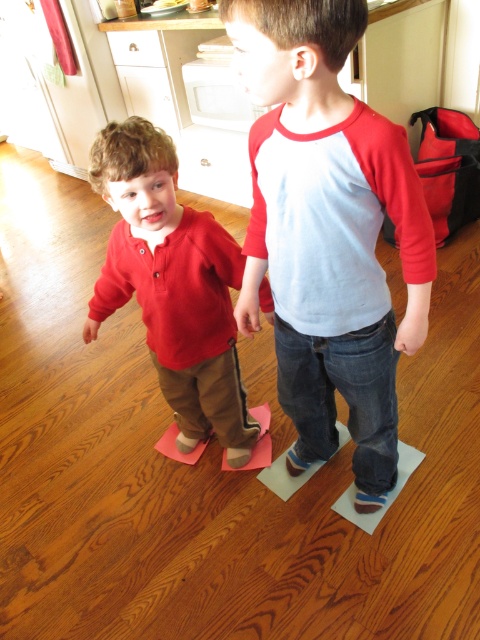
Between matte red shirt at center and matte red sweater at left, which one is positioned higher?

matte red shirt at center is above.

Does matte red shirt at center have a greater width compared to matte red sweater at left?

Incorrect, matte red shirt at center's width does not surpass matte red sweater at left's.

Find the location of a particular element. The width and height of the screenshot is (480, 640). matte red shirt at center is located at coordinates (327, 232).

The image size is (480, 640). Find the location of `matte red shirt at center`. matte red shirt at center is located at coordinates (327, 232).